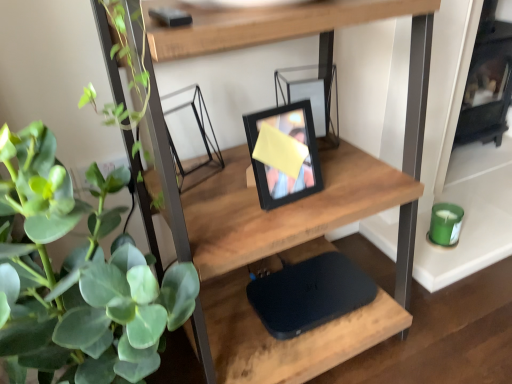
What do you see at coordinates (483, 88) in the screenshot?
I see `black glass fireplace at right` at bounding box center [483, 88].

The height and width of the screenshot is (384, 512). I want to click on black glass fireplace at right, so click(x=483, y=88).

Image resolution: width=512 pixels, height=384 pixels. What do you see at coordinates (309, 294) in the screenshot?
I see `black matte laptop at center` at bounding box center [309, 294].

Where is `black matte picture frame at center`? The height and width of the screenshot is (384, 512). black matte picture frame at center is located at coordinates (277, 115).

This screenshot has width=512, height=384. Identify the location of green matte plant at left. (77, 277).

From the image's perspective, is black matte picture frame at center positioned above or below black glass fireplace at right?

Based on their image positions, black matte picture frame at center is located beneath black glass fireplace at right.

How many degrees apart are the facing directions of black matte picture frame at center and black glass fireplace at right?

The angle between the facing direction of black matte picture frame at center and the facing direction of black glass fireplace at right is 1.93 degrees.

Locate an element on the screen. The width and height of the screenshot is (512, 384). fireplace behind the black matte picture frame at center is located at coordinates (483, 88).

Is black matte picture frame at center bigger or smaller than black glass fireplace at right?

Clearly, black matte picture frame at center is smaller in size than black glass fireplace at right.

Is there a large distance between black matte laptop at center and black glass fireplace at right?

black matte laptop at center is actually quite close to black glass fireplace at right.

Considering the positions of point (354, 286) and point (478, 98), is point (354, 286) closer or farther from the camera than point (478, 98)?

Point (354, 286).

Which of these two, black matte laptop at center or black glass fireplace at right, stands taller?

black glass fireplace at right is taller.

Can you confirm if black matte laptop at center is positioned to the left of black glass fireplace at right?

Correct, you'll find black matte laptop at center to the left of black glass fireplace at right.

Is black matte picture frame at center inside green matte plant at left?

No, black matte picture frame at center is located outside of green matte plant at left.

Is green matte plant at left aimed at black matte picture frame at center?

No, green matte plant at left is not turned towards black matte picture frame at center.

From the picture: Can you confirm if green matte plant at left is positioned to the left of black matte picture frame at center?

Correct, you'll find green matte plant at left to the left of black matte picture frame at center.

Who is smaller, green matte plant at left or black matte picture frame at center?

Smaller between the two is black matte picture frame at center.

Between black matte laptop at center and black matte picture frame at center, which one has smaller width?

black matte picture frame at center is thinner.

Is black matte laptop at center to the left or to the right of black matte picture frame at center in the image?

black matte laptop at center is positioned on black matte picture frame at center's right side.

Considering the relative sizes of black matte laptop at center and black matte picture frame at center in the image provided, is black matte laptop at center smaller than black matte picture frame at center?

Indeed, black matte laptop at center has a smaller size compared to black matte picture frame at center.

Who is more distant, black matte picture frame at center or wooden shelf at center?

Positioned behind is black matte picture frame at center.

Is black matte picture frame at center inside the boundaries of wooden shelf at center, or outside?

black matte picture frame at center is spatially positioned inside wooden shelf at center.

Would you consider black matte picture frame at center to be distant from wooden shelf at center?

Actually, black matte picture frame at center and wooden shelf at center are a little close together.

Could you tell me if black matte picture frame at center is facing wooden shelf at center?

Yes, black matte picture frame at center is oriented towards wooden shelf at center.

There is a green matte plant at left. What are the coordinates of `shelf above it (from a real-world perspective)` in the screenshot? It's located at (322, 153).

From a real-world perspective, is wooden shelf at center beneath green matte plant at left?

No.

Is wooden shelf at center in contact with green matte plant at left?

No, wooden shelf at center is not touching green matte plant at left.

How far apart are wooden shelf at center and green matte plant at left?

They are 9.39 inches apart.

Does point (495, 1) appear closer or farther from the camera than point (319, 256)?

Point (495, 1) is farther from the camera than point (319, 256).

Can you confirm if black glass fireplace at right is bigger than black matte laptop at center?

Indeed, black glass fireplace at right has a larger size compared to black matte laptop at center.

Is black glass fireplace at right taller or shorter than black matte laptop at center?

Clearly, black glass fireplace at right is taller compared to black matte laptop at center.

Identify the location of fireplace on the right of black matte picture frame at center. (483, 88).

You are a GUI agent. You are given a task and a screenshot of the screen. Output one action in this format:
    pyautogui.click(x=<x>, y=<y>)
    Task: Click on the fireplace above the black matte laptop at center (from the image's perspective)
    The width and height of the screenshot is (512, 384).
    Given the screenshot: What is the action you would take?
    pyautogui.click(x=483, y=88)

Based on their spatial positions, is black glass fireplace at right or wooden shelf at center closer to green matte plant at left?

wooden shelf at center lies closer to green matte plant at left than the other object.

From the picture: When comparing their distances from wooden shelf at center, does black glass fireplace at right or black matte picture frame at center seem further?

Result: black glass fireplace at right.

Estimate the real-world distances between objects in this image. Which object is closer to green matte plant at left, black matte laptop at center or wooden shelf at center?

wooden shelf at center is positioned closer to the anchor green matte plant at left.

Looking at the image, which one is located closer to black matte laptop at center, wooden shelf at center or black matte picture frame at center?

wooden shelf at center is positioned closer to the anchor black matte laptop at center.

Which object lies nearer to the anchor point black matte picture frame at center, wooden shelf at center or black glass fireplace at right?

Among the two, wooden shelf at center is located nearer to black matte picture frame at center.

From the image, which object appears to be nearer to black matte laptop at center, black matte picture frame at center or green matte plant at left?

black matte picture frame at center.

Based on their spatial positions, is green matte plant at left or black glass fireplace at right further from black matte laptop at center?

Result: Based on the image, black glass fireplace at right appears to be further to black matte laptop at center.

Considering their positions, is black glass fireplace at right positioned closer to wooden shelf at center than black matte laptop at center?

black matte laptop at center lies closer to wooden shelf at center than the other object.

What are the coordinates of `laptop located between green matte plant at left and black glass fireplace at right in the left-right direction` in the screenshot? It's located at (309, 294).

Locate an element on the screen. The height and width of the screenshot is (384, 512). shelf situated between black matte picture frame at center and black glass fireplace at right from left to right is located at coordinates (322, 153).

Find the location of a particular element. laptop located between wooden shelf at center and black glass fireplace at right in the depth direction is located at coordinates (309, 294).

The width and height of the screenshot is (512, 384). Find the location of `picture frame between green matte plant at left and black matte laptop at center from front to back`. picture frame between green matte plant at left and black matte laptop at center from front to back is located at coordinates (277, 115).